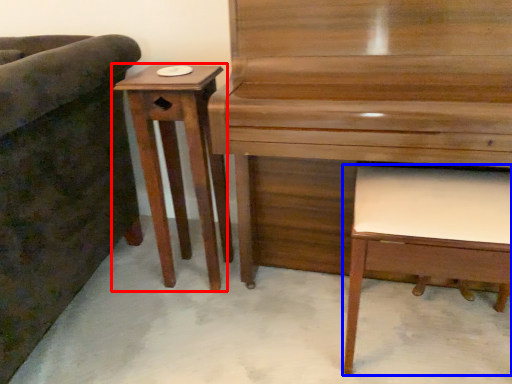
Question: Which object is further to the camera taking this photo, table (highlighted by a red box) or music stool (highlighted by a blue box)?

Choices:
 (A) table
 (B) music stool

Answer: (A)